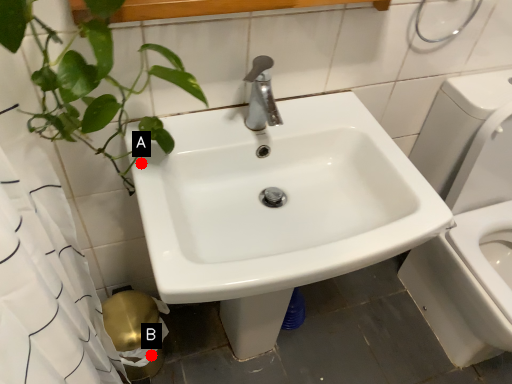
Question: Two points are circled on the image, labeled by A and B beside each circle. Which point is closer to the camera?

Choices:
 (A) A is closer
 (B) B is closer

Answer: (A)